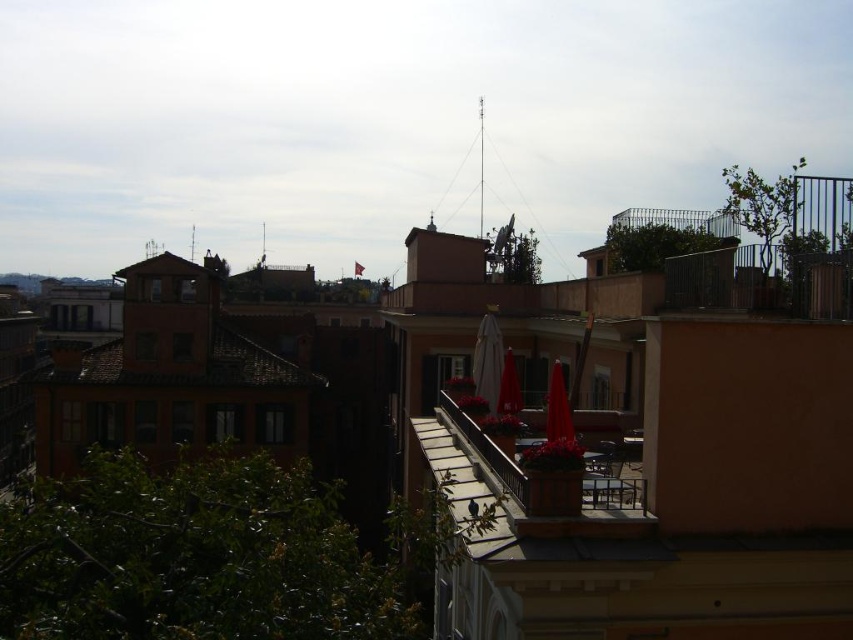
Measure the distance between terracotta pot at center and camera.

They are 43.04 feet apart.

Is point (653, 522) in front of point (482, 340)?

Yes.

Who is more distant from viewer, (538, 513) or (486, 356)?

The point (486, 356) is more distant.

Find the location of a particular element. The height and width of the screenshot is (640, 853). terracotta pot at center is located at coordinates (552, 483).

Measure the distance from matte red umbrella at center-right to red matte umbrella at center.

The distance of matte red umbrella at center-right from red matte umbrella at center is 15.24 feet.

Between matte red umbrella at center-right and red matte umbrella at center, which one has less height?

red matte umbrella at center

Does point (560, 436) lie in front of point (508, 388)?

Yes, it is.

You are a GUI agent. You are given a task and a screenshot of the screen. Output one action in this format:
    pyautogui.click(x=<x>, y=<y>)
    Task: Click on the matte red umbrella at center-right
    The image size is (853, 640).
    Given the screenshot: What is the action you would take?
    pyautogui.click(x=558, y=406)

Does terracotta pot at center have a larger size compared to red matte umbrella at center?

Correct, terracotta pot at center is larger in size than red matte umbrella at center.

Which is below, terracotta pot at center or red matte umbrella at center?

terracotta pot at center is lower down.

Does point (543, 486) lie in front of point (506, 362)?

That is True.

Identify the location of terracotta pot at center. The width and height of the screenshot is (853, 640). (552, 483).